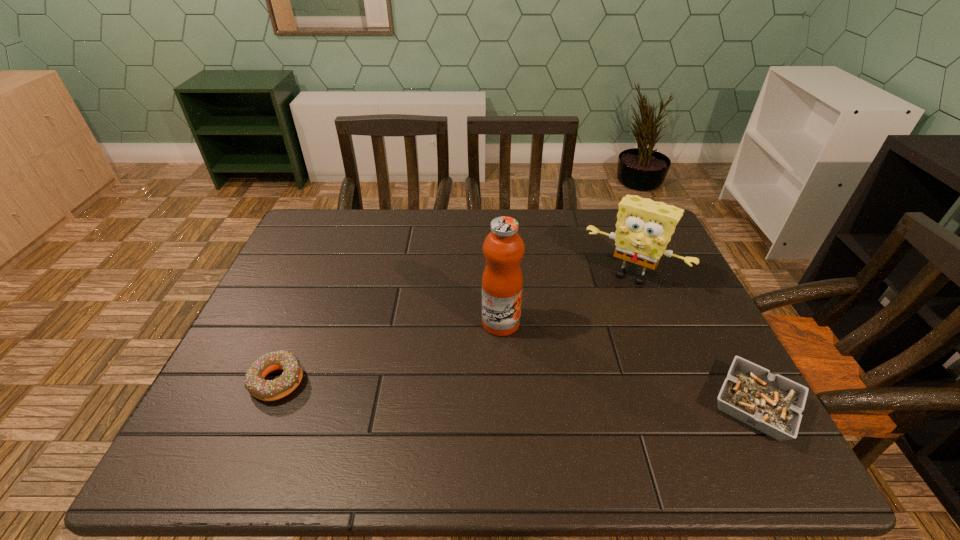
Where is `vacant space located on the front label of the second farthest object`? vacant space located on the front label of the second farthest object is located at coordinates tap(552, 388).

I want to click on free spot located on the face of the farthest object, so click(587, 340).

Find the location of a particular element. vacant position located on the face of the farthest object is located at coordinates (550, 406).

Locate an element on the screen. This screenshot has width=960, height=540. free location located on the face of the farthest object is located at coordinates (589, 334).

This screenshot has width=960, height=540. What are the coordinates of `doughnut at the near edge` in the screenshot? It's located at (266, 390).

The image size is (960, 540). I want to click on ashtray at the near edge, so click(x=770, y=403).

In order to click on object at the left edge in this screenshot , I will do `click(266, 390)`.

At what (x,y) coordinates should I click in order to perform the action: click on ashtray that is at the right edge. Please return your answer as a coordinate pair (x, y). Image resolution: width=960 pixels, height=540 pixels. Looking at the image, I should click on (770, 403).

Where is `sponge located in the right edge section of the desktop`? This screenshot has width=960, height=540. sponge located in the right edge section of the desktop is located at coordinates point(644,227).

This screenshot has height=540, width=960. I want to click on object located at the near left corner, so pyautogui.click(x=266, y=390).